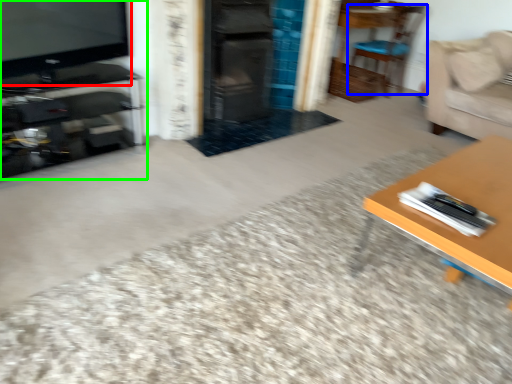
Question: Estimate the real-world distances between objects in this image. Which object is closer to television (highlighted by a red box), chair (highlighted by a blue box) or entertainment center (highlighted by a green box)?

Choices:
 (A) chair
 (B) entertainment center

Answer: (B)